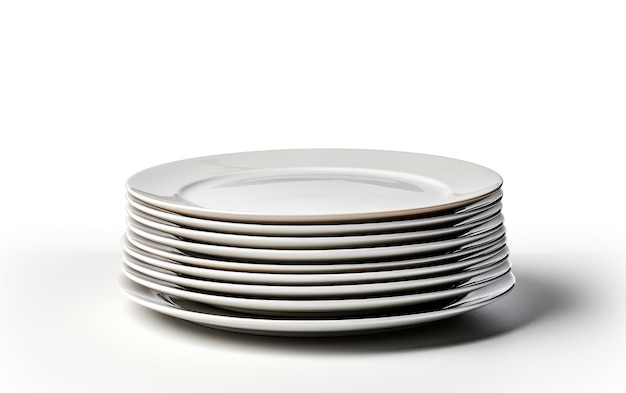
At what (x,y) coordinates should I click in order to perform the action: click on plates. Please return your answer as a coordinate pair (x, y). This screenshot has height=393, width=626. Looking at the image, I should click on (289, 327), (239, 304), (160, 276), (155, 259), (146, 246), (141, 230), (141, 220), (145, 210), (148, 202).